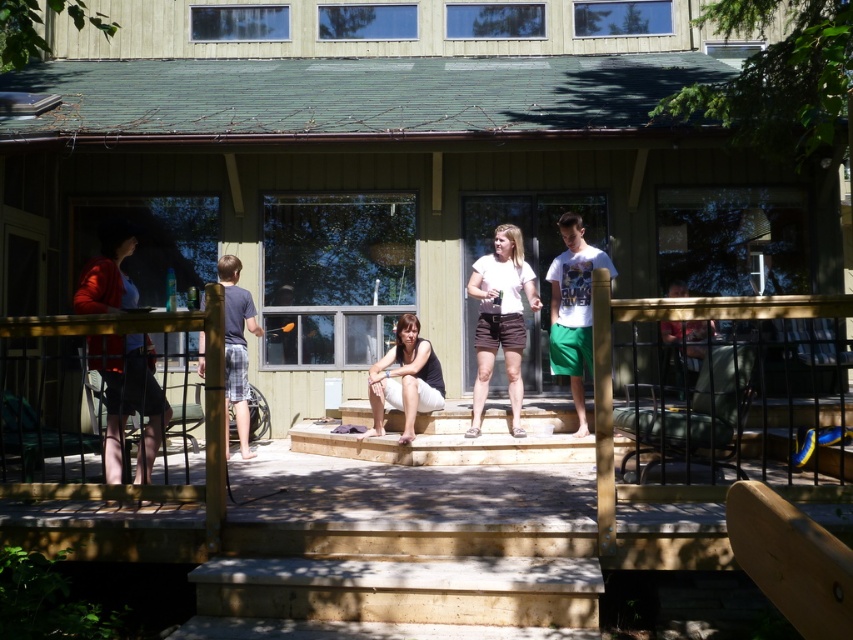
Question: Does light brown wooden stairs at center come behind black fabric at center?

Choices:
 (A) no
 (B) yes

Answer: (A)

Question: Which object is the closest to the plaid shorts at left?

Choices:
 (A) black fabric at center
 (B) light brown wooden stairs at center
 (C) matte red shirt at upper right
 (D) white cotton shirt at center

Answer: (A)

Question: Among these points, which one is farthest from the camera?

Choices:
 (A) (111, 438)
 (B) (532, 310)
 (C) (566, 221)
 (D) (241, 369)

Answer: (B)

Question: Can you confirm if black fabric at center is positioned to the left of plaid shorts at left?

Choices:
 (A) yes
 (B) no

Answer: (B)

Question: Does white cotton t-shirt at center lie behind black fabric at center?

Choices:
 (A) yes
 (B) no

Answer: (A)

Question: Among these points, which one is farthest from the camera?

Choices:
 (A) click(x=404, y=314)
 (B) click(x=120, y=317)
 (C) click(x=459, y=465)

Answer: (A)